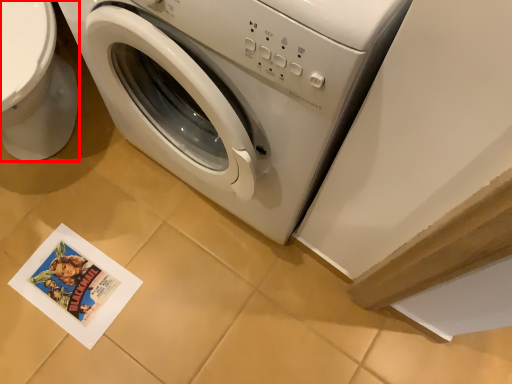
Question: In this image, where is toilet bowl (annotated by the red box) located relative to washing machine?

Choices:
 (A) right
 (B) left

Answer: (B)